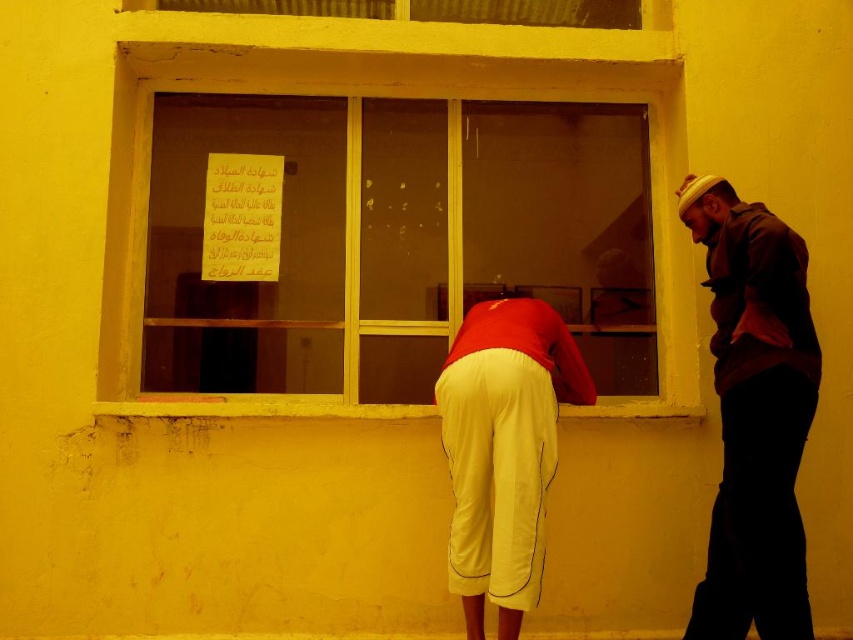
You are a photographer trying to capture a candid shot of both the red fabric shirt at center and the dark brown leather jacket at right. Based on their positions, which one is closer to the camera?

The red fabric shirt at center is located above the dark brown leather jacket at right, which means it is closer to the camera.

You are standing in front of the building with a bright yellow facade. There is a transparent glass window at center. Can you see the Arabic text notice on the window from your current position?

The transparent glass window at center has a piece of paper with Arabic text affixed to one of its panes, so yes, you can see the Arabic text notice on the window from your current position.

You are standing at the point marked as point (384, 93) in the image. What object are you directly facing?

The point (384, 93) marks the transparent glass window at center, so you are directly facing the transparent glass window at center.